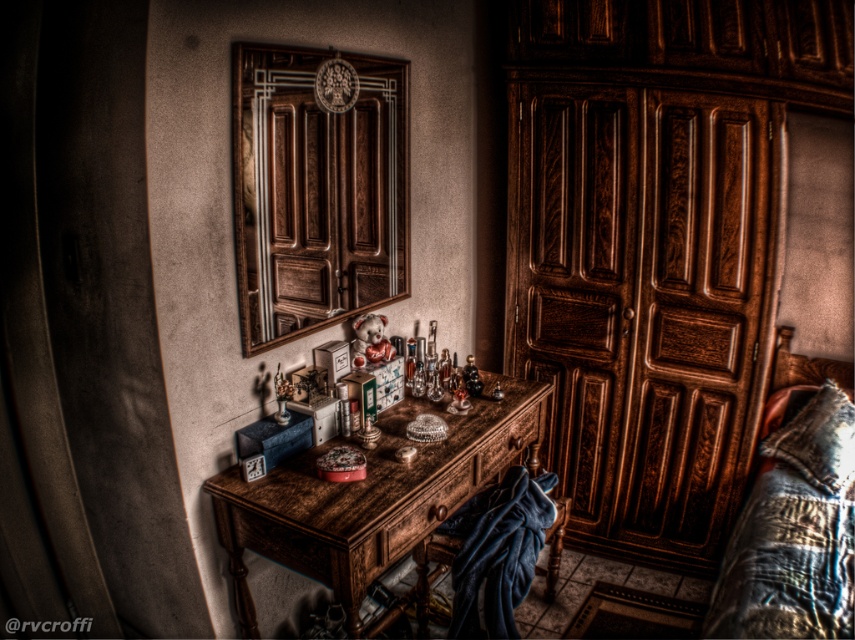
You are standing in the room and want to reach both the wooden dresser at center and the rustic wood table at center. Which object will you encounter first as you move forward?

You will encounter the wooden dresser at center first because it is closer to you than the rustic wood table at center, which is positioned further away.

You are standing in the room and want to reach the point marked at coordinates (716,120). If your arm can extend 1.8 meters, can you reach that point without moving?

The point at (716,120) is 1.93 meters away from you. Since your arm can only extend 1.8 meters, you cannot reach it without moving closer.

You are organizing a small party and need to move a 1.2 meter wide table into the room. The table must be placed between the wooden dresser at center and the wooden armoire at center. Is there enough space between them to fit the table?

The wooden armoire at center is behind the wooden dresser at center, so there is no space between them to fit the table.